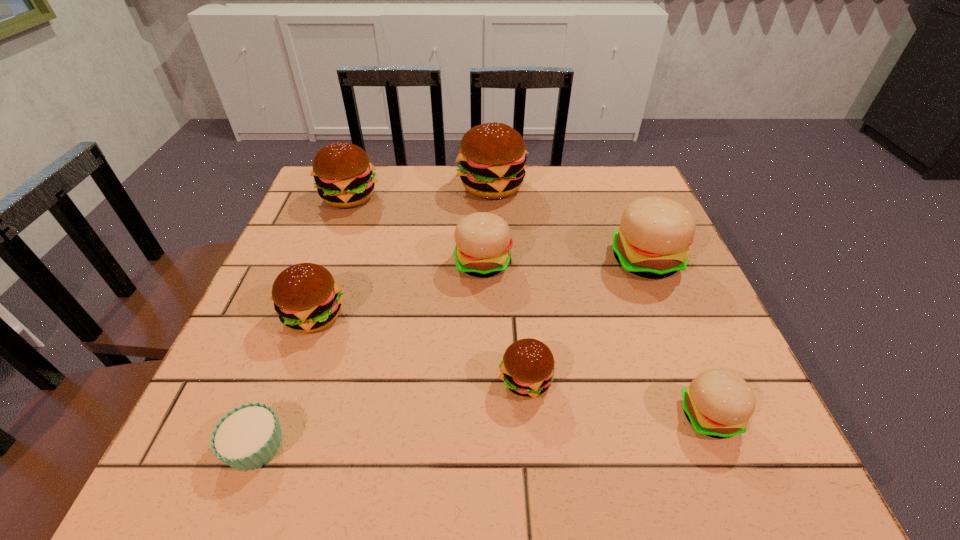
Identify the location of free space between the second smallest beige hamburger and the third nearest hamburger. The image size is (960, 540). 398,289.

Where is `free area in between the nearest beige hamburger and the nearest brown hamburger`? The image size is (960, 540). free area in between the nearest beige hamburger and the nearest brown hamburger is located at coordinates (617, 398).

You are a GUI agent. You are given a task and a screenshot of the screen. Output one action in this format:
    pyautogui.click(x=<x>, y=<y>)
    Task: Click on the empty space between the biggest beige hamburger and the nearest brown hamburger
    This screenshot has height=540, width=960.
    Given the screenshot: What is the action you would take?
    click(x=586, y=320)

The image size is (960, 540). Find the location of `free space between the biggest beige hamburger and the third farthest brown hamburger`. free space between the biggest beige hamburger and the third farthest brown hamburger is located at coordinates (480, 288).

Locate an element on the screen. The image size is (960, 540). free spot between the smallest beige hamburger and the biggest beige hamburger is located at coordinates (678, 338).

Identify the location of vacant area between the second smallest brown hamburger and the biggest beige hamburger. This screenshot has height=540, width=960. (480, 288).

Identify the location of vacant area between the nearest brown hamburger and the leftmost beige hamburger. This screenshot has width=960, height=540. (504, 322).

The image size is (960, 540). I want to click on free space between the biggest beige hamburger and the nearest brown hamburger, so click(586, 320).

This screenshot has height=540, width=960. I want to click on vacant space in between the second biggest brown hamburger and the tallest object, so click(x=420, y=192).

Select which object appears as the second closest to the biggest beige hamburger. Please provide its 2D coordinates. Your answer should be formatted as a tuple, i.e. [(x, y)], where the tuple contains the x and y coordinates of a point satisfying the conditions above.

[(483, 241)]